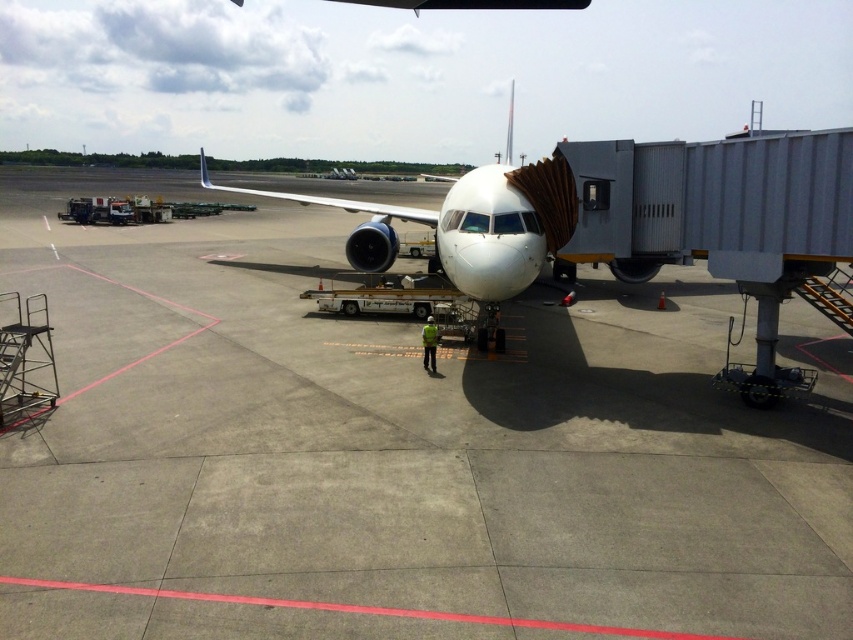
Is gray concrete tarmac at center further to camera compared to white matte airplane at center?

That is False.

Find the location of a particular element. This screenshot has width=853, height=640. gray concrete tarmac at center is located at coordinates (396, 451).

Locate an element on the screen. gray concrete tarmac at center is located at coordinates (396, 451).